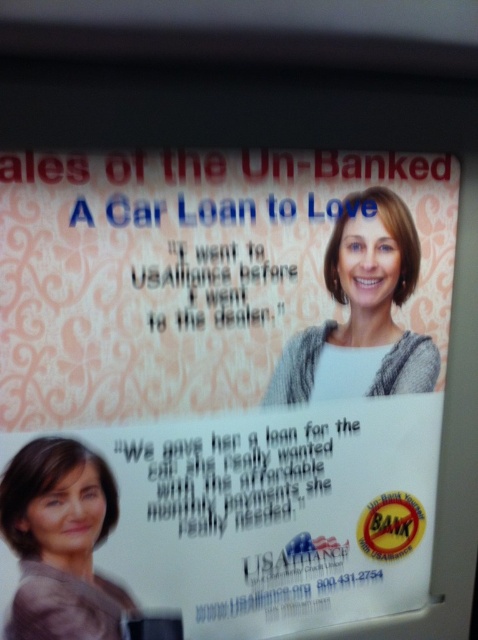
Question: Is white paper poster at center above gray knitted sweater at center?

Choices:
 (A) yes
 (B) no

Answer: (B)

Question: Which object appears farthest from the camera in this image?

Choices:
 (A) matte gray sweater at lower left
 (B) white paper poster at center
 (C) gray knitted sweater at center

Answer: (C)

Question: Estimate the real-world distances between objects in this image. Which object is farther from the gray knitted sweater at center?

Choices:
 (A) white paper poster at center
 (B) matte gray sweater at lower left

Answer: (B)

Question: Does white paper poster at center have a lesser width compared to matte gray sweater at lower left?

Choices:
 (A) yes
 (B) no

Answer: (B)

Question: Is matte gray sweater at lower left positioned in front of gray knitted sweater at center?

Choices:
 (A) no
 (B) yes

Answer: (B)

Question: Which object is farther from the camera taking this photo?

Choices:
 (A) white paper poster at center
 (B) gray knitted sweater at center
 (C) matte gray sweater at lower left

Answer: (B)